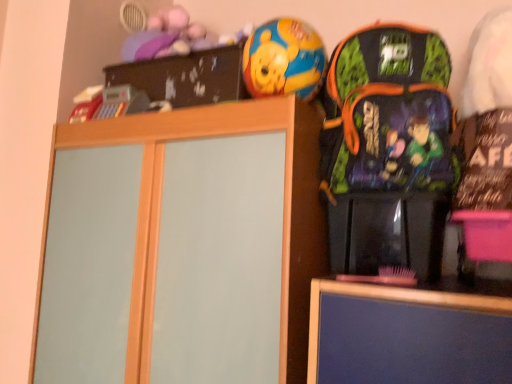
Locate an element on the screen. multicolored fabric backpack at right is located at coordinates (387, 113).

Measure the distance between wooden cabinet at center and camera.

wooden cabinet at center is 34.94 inches from camera.

This screenshot has height=384, width=512. What are the coordinates of `wooden cabinet at center` in the screenshot? It's located at (182, 247).

The width and height of the screenshot is (512, 384). Describe the element at coordinates (284, 59) in the screenshot. I see `shiny plastic ball at upper center` at that location.

You are a GUI agent. You are given a task and a screenshot of the screen. Output one action in this format:
    pyautogui.click(x=<x>, y=<y>)
    Task: Click on the multicolored fabric backpack at right
    
    Given the screenshot: What is the action you would take?
    pyautogui.click(x=387, y=113)

Is wooden cabinet at center with shiny plastic ball at upper center?

No, wooden cabinet at center is not with shiny plastic ball at upper center.

Does wooden cabinet at center turn towards shiny plastic ball at upper center?

No, wooden cabinet at center does not turn towards shiny plastic ball at upper center.

Does wooden cabinet at center appear on the left side of shiny plastic ball at upper center?

Yes, wooden cabinet at center is to the left of shiny plastic ball at upper center.

Considering the points (101, 372) and (262, 90), which point is in front, point (101, 372) or point (262, 90)?

The point (262, 90) is closer to the camera.

Is multicolored fabric backpack at right facing towards wooden cabinet at center?

No.

Can you confirm if multicolored fabric backpack at right is positioned to the right of wooden cabinet at center?

Yes, multicolored fabric backpack at right is to the right of wooden cabinet at center.

From the image's perspective, is multicolored fabric backpack at right located beneath wooden cabinet at center?

Incorrect, from the image's perspective, multicolored fabric backpack at right is higher than wooden cabinet at center.

Is multicolored fabric backpack at right located outside wooden cabinet at center?

multicolored fabric backpack at right lies outside wooden cabinet at center's area.

Is multicolored fabric backpack at right looking in the opposite direction of shiny plastic ball at upper center?

multicolored fabric backpack at right does not have its back to shiny plastic ball at upper center.

Considering the sizes of objects multicolored fabric backpack at right and shiny plastic ball at upper center in the image provided, who is smaller, multicolored fabric backpack at right or shiny plastic ball at upper center?

shiny plastic ball at upper center is smaller.

Considering the sizes of objects multicolored fabric backpack at right and shiny plastic ball at upper center in the image provided, who is shorter, multicolored fabric backpack at right or shiny plastic ball at upper center?

With less height is shiny plastic ball at upper center.

Considering their positions, is multicolored fabric backpack at right located in front of or behind shiny plastic ball at upper center?

multicolored fabric backpack at right is positioned closer to the viewer than shiny plastic ball at upper center.

From a real-world perspective, is wooden cabinet at center over multicolored fabric backpack at right?

Actually, wooden cabinet at center is physically below multicolored fabric backpack at right in the real world.

This screenshot has width=512, height=384. Find the location of `backpack in front of the wooden cabinet at center`. backpack in front of the wooden cabinet at center is located at coordinates (387, 113).

Can you confirm if wooden cabinet at center is thinner than multicolored fabric backpack at right?

No, wooden cabinet at center is not thinner than multicolored fabric backpack at right.

Is multicolored fabric backpack at right inside shiny plastic ball at upper center?

No, multicolored fabric backpack at right is located outside of shiny plastic ball at upper center.

Is shiny plastic ball at upper center directly adjacent to multicolored fabric backpack at right?

No, shiny plastic ball at upper center is not beside multicolored fabric backpack at right.

From the image's perspective, does shiny plastic ball at upper center appear higher than multicolored fabric backpack at right?

Indeed, from the image's perspective, shiny plastic ball at upper center is shown above multicolored fabric backpack at right.

Considering the points (278, 18) and (425, 170), which point is behind, point (278, 18) or point (425, 170)?

Point (278, 18)

Does shiny plastic ball at upper center have a lesser width compared to wooden cabinet at center?

Indeed, shiny plastic ball at upper center has a lesser width compared to wooden cabinet at center.

From a real-world perspective, who is located higher, shiny plastic ball at upper center or wooden cabinet at center?

shiny plastic ball at upper center, from a real-world perspective.

Is shiny plastic ball at upper center not close to wooden cabinet at center?

No, there isn't a large distance between shiny plastic ball at upper center and wooden cabinet at center.

Which object is further away from the camera taking this photo, shiny plastic ball at upper center or wooden cabinet at center?

shiny plastic ball at upper center is more distant.

You are a GUI agent. You are given a task and a screenshot of the screen. Output one action in this format:
    pyautogui.click(x=<x>, y=<y>)
    Task: Click on the toy lying behind the wooden cabinet at center
    
    Given the screenshot: What is the action you would take?
    pyautogui.click(x=284, y=59)

Identify the location of backpack in front of the wooden cabinet at center. Image resolution: width=512 pixels, height=384 pixels. (387, 113).

From the image, which object appears to be farther from multicolored fabric backpack at right, wooden cabinet at center or shiny plastic ball at upper center?

wooden cabinet at center.

When comparing their distances from multicolored fabric backpack at right, does shiny plastic ball at upper center or wooden cabinet at center seem closer?

shiny plastic ball at upper center lies closer to multicolored fabric backpack at right than the other object.

Considering their positions, is multicolored fabric backpack at right positioned further to wooden cabinet at center than shiny plastic ball at upper center?

Among the two, shiny plastic ball at upper center is located further to wooden cabinet at center.

Consider the image. Estimate the real-world distances between objects in this image. Which object is closer to shiny plastic ball at upper center, multicolored fabric backpack at right or wooden cabinet at center?

multicolored fabric backpack at right is closer to shiny plastic ball at upper center.

Which object lies further to the anchor point wooden cabinet at center, shiny plastic ball at upper center or multicolored fabric backpack at right?

Among the two, shiny plastic ball at upper center is located further to wooden cabinet at center.

Which object lies nearer to the anchor point shiny plastic ball at upper center, wooden cabinet at center or multicolored fabric backpack at right?

multicolored fabric backpack at right lies closer to shiny plastic ball at upper center than the other object.

Where is `backpack that lies between shiny plastic ball at upper center and wooden cabinet at center from top to bottom`? This screenshot has width=512, height=384. backpack that lies between shiny plastic ball at upper center and wooden cabinet at center from top to bottom is located at coordinates (387, 113).